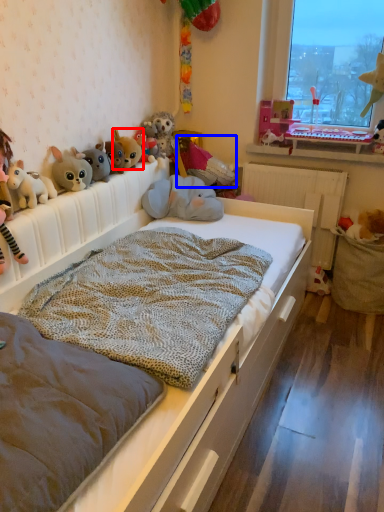
Question: Which of the following is the farthest to the observer, toy (highlighted by a red box) or toy (highlighted by a blue box)?

Choices:
 (A) toy
 (B) toy

Answer: (B)